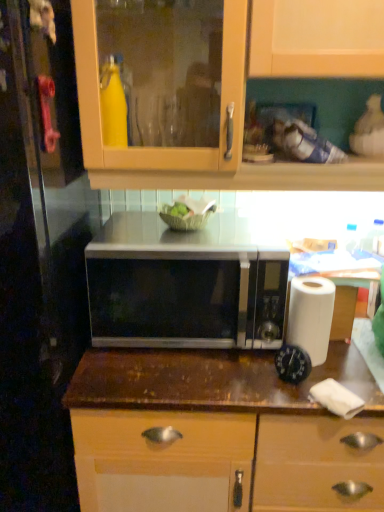
This screenshot has width=384, height=512. Find the location of `space that is in front of white paper at right`. space that is in front of white paper at right is located at coordinates (313, 384).